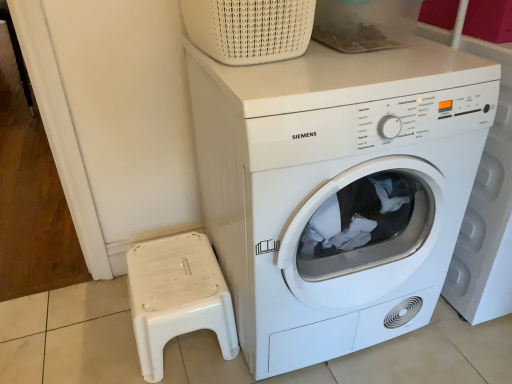
Question: From a real-world perspective, is white woven basket at upper center beneath white plastic stool at lower left?

Choices:
 (A) yes
 (B) no

Answer: (B)

Question: Considering the relative sizes of white woven basket at upper center and white plastic stool at lower left in the image provided, is white woven basket at upper center shorter than white plastic stool at lower left?

Choices:
 (A) no
 (B) yes

Answer: (B)

Question: Is white woven basket at upper center not inside white plastic stool at lower left?

Choices:
 (A) no
 (B) yes

Answer: (B)

Question: Is white plastic stool at lower left a part of white woven basket at upper center?

Choices:
 (A) yes
 (B) no

Answer: (B)

Question: From a real-world perspective, does white woven basket at upper center stand above white plastic stool at lower left?

Choices:
 (A) yes
 (B) no

Answer: (A)

Question: In terms of size, does white matte washing machine at center appear bigger or smaller than white plastic stool at lower left?

Choices:
 (A) big
 (B) small

Answer: (A)

Question: Looking at their shapes, would you say white matte washing machine at center is wider or thinner than white plastic stool at lower left?

Choices:
 (A) wide
 (B) thin

Answer: (A)

Question: From the image's perspective, is white matte washing machine at center above or below white plastic stool at lower left?

Choices:
 (A) below
 (B) above

Answer: (B)

Question: Is white matte washing machine at center in front of or behind white plastic stool at lower left in the image?

Choices:
 (A) behind
 (B) front

Answer: (B)

Question: Considering the positions of white woven basket at upper center and white matte washing machine at center in the image, is white woven basket at upper center bigger or smaller than white matte washing machine at center?

Choices:
 (A) big
 (B) small

Answer: (B)

Question: Choose the correct answer: Is white woven basket at upper center inside white matte washing machine at center or outside it?

Choices:
 (A) inside
 (B) outside

Answer: (B)

Question: Considering the positions of white woven basket at upper center and white matte washing machine at center in the image, is white woven basket at upper center taller or shorter than white matte washing machine at center?

Choices:
 (A) short
 (B) tall

Answer: (A)

Question: In terms of width, does white woven basket at upper center look wider or thinner when compared to white matte washing machine at center?

Choices:
 (A) thin
 (B) wide

Answer: (A)

Question: Would you say white matte washing machine at center is inside or outside white woven basket at upper center?

Choices:
 (A) outside
 (B) inside

Answer: (A)

Question: From a real-world perspective, is white matte washing machine at center above or below white woven basket at upper center?

Choices:
 (A) above
 (B) below

Answer: (B)